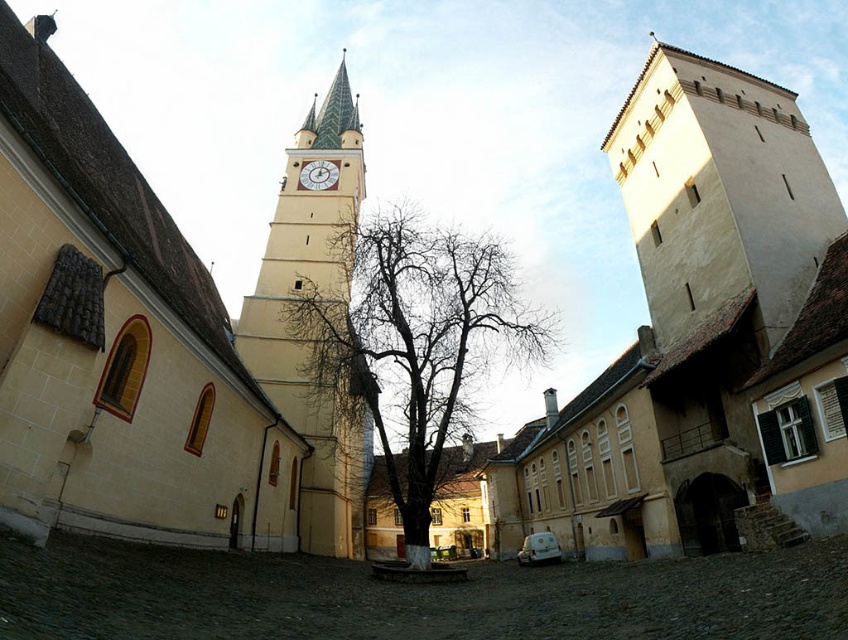
Can you confirm if smooth cream-colored clock tower at center is wider than matte white clock at center?

Correct, the width of smooth cream-colored clock tower at center exceeds that of matte white clock at center.

Can you confirm if smooth cream-colored clock tower at center is bigger than matte white clock at center?

Correct, smooth cream-colored clock tower at center is larger in size than matte white clock at center.

The height and width of the screenshot is (640, 848). What are the coordinates of `smooth cream-colored clock tower at center` in the screenshot? It's located at (305, 326).

Find the location of a particular element. This screenshot has height=640, width=848. smooth cream-colored clock tower at center is located at coordinates (305, 326).

Does bare branches at center appear under matte white clock at center?

Yes.

Can you confirm if bare branches at center is positioned to the right of matte white clock at center?

Correct, you'll find bare branches at center to the right of matte white clock at center.

Is point (374, 378) more distant than point (310, 161)?

No.

You are a GUI agent. You are given a task and a screenshot of the screen. Output one action in this format:
    pyautogui.click(x=<x>, y=<y>)
    Task: Click on the bare branches at center
    
    Given the screenshot: What is the action you would take?
    pyautogui.click(x=411, y=342)

Can you confirm if matte yellow church tower at upper center is shorter than matte white clock at center?

No, matte yellow church tower at upper center is not shorter than matte white clock at center.

This screenshot has width=848, height=640. In order to click on matte yellow church tower at upper center in this screenshot , I will do `click(160, 337)`.